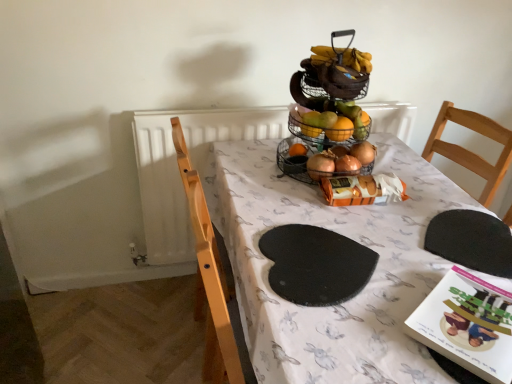
Identify the location of free space behind black felt mat at center, which ranks as the first mat in left-to-right order. (295, 205).